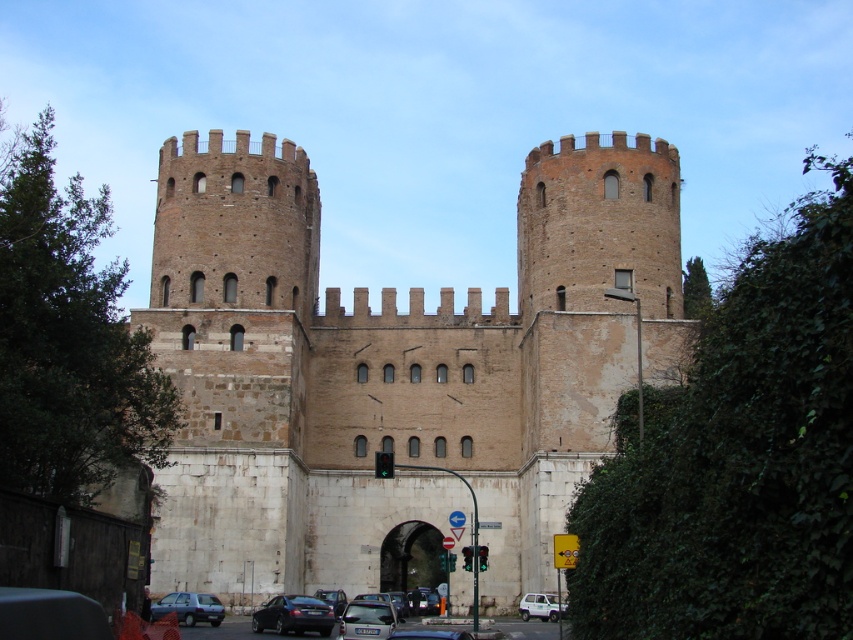
Is brown stone castle at center below metallic silver car at center?

No, brown stone castle at center is not below metallic silver car at center.

Between brown stone castle at center and metallic silver car at center, which one appears on the left side from the viewer's perspective?

From the viewer's perspective, metallic silver car at center appears more on the left side.

Is point (274, 346) positioned after point (361, 634)?

Yes, it is behind point (361, 634).

What are the coordinates of `brown stone castle at center` in the screenshot? It's located at (393, 369).

Can you confirm if brown stone castle at center is bigger than shiny black sedan at lower center?

Correct, brown stone castle at center is larger in size than shiny black sedan at lower center.

Can you confirm if brown stone castle at center is thinner than shiny black sedan at lower center?

No, brown stone castle at center is not thinner than shiny black sedan at lower center.

This screenshot has width=853, height=640. What are the coordinates of `brown stone castle at center` in the screenshot? It's located at (393, 369).

Is matte gray car at lower left bigger than white plastic van at lower center?

Yes.

Can you confirm if matte gray car at lower left is thinner than white plastic van at lower center?

No.

Is point (189, 593) behind point (529, 612)?

No, it is in front of (529, 612).

Locate an element on the screen. matte gray car at lower left is located at coordinates (189, 608).